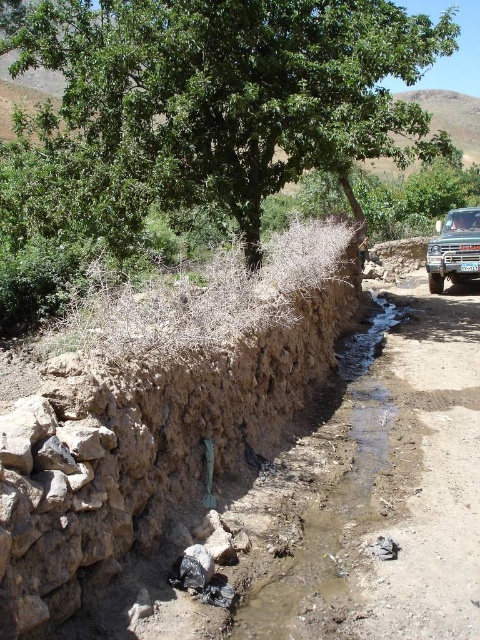
Question: Is green leafy tree at upper center to the left of metallic silver truck at right from the viewer's perspective?

Choices:
 (A) no
 (B) yes

Answer: (B)

Question: Which object is closer to the camera taking this photo?

Choices:
 (A) metallic silver truck at right
 (B) green leafy tree at upper center

Answer: (B)

Question: Does green leafy tree at upper center come behind metallic silver truck at right?

Choices:
 (A) no
 (B) yes

Answer: (A)

Question: Can you confirm if green leafy tree at upper center is smaller than metallic silver truck at right?

Choices:
 (A) no
 (B) yes

Answer: (A)

Question: Which point appears farthest from the camera in this image?

Choices:
 (A) (208, 4)
 (B) (476, 243)

Answer: (B)